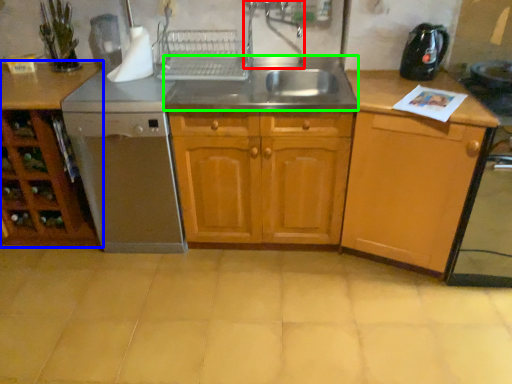
Question: Considering the real-world distances, which object is closest to faucet (highlighted by a red box)? cabinetry (highlighted by a blue box) or sink (highlighted by a green box).

Choices:
 (A) cabinetry
 (B) sink

Answer: (B)